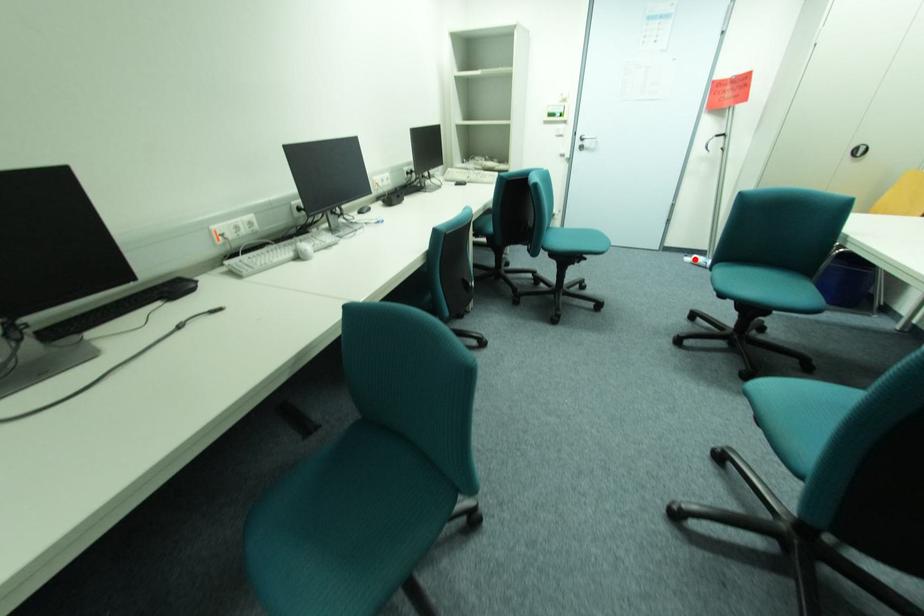
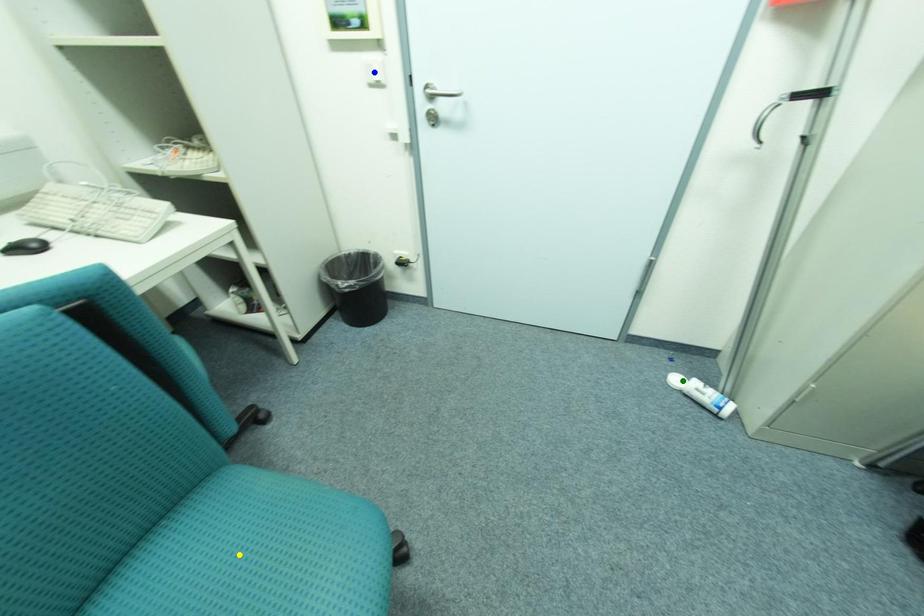
Question: I am providing you with two images of the same scene from different viewpoints. A red point is marked on the first image. You are given multiple points on the second image. In image 2, which mark is for the same physical point as the one in image 1?

Choices:
 (A) green point
 (B) blue point
 (C) yellow point

Answer: (A)